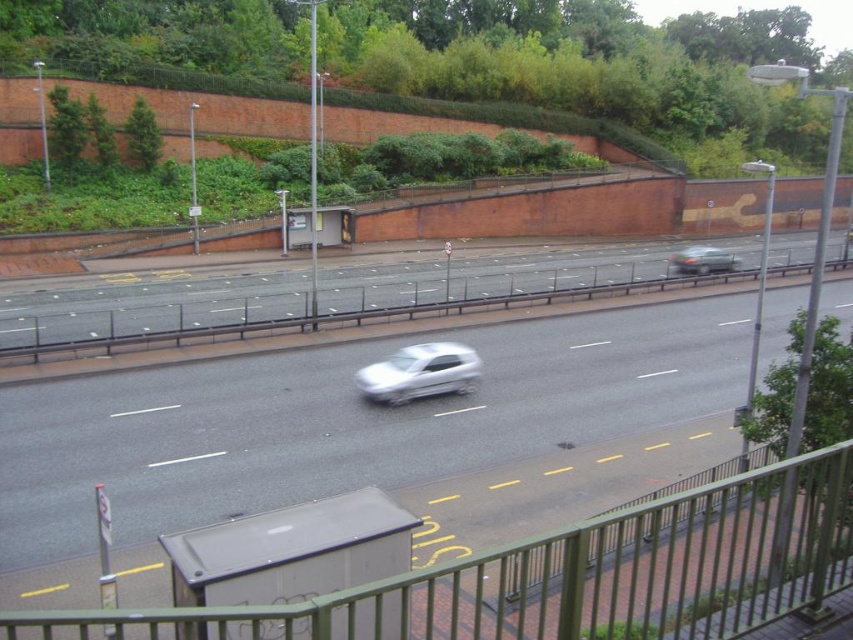
Is white glossy car at center behind green metallic car at right?

No, white glossy car at center is in front of green metallic car at right.

Between white glossy car at center and green metallic car at right, which one has more height?

Standing taller between the two is green metallic car at right.

Image resolution: width=853 pixels, height=640 pixels. Describe the element at coordinates (421, 372) in the screenshot. I see `white glossy car at center` at that location.

You are a GUI agent. You are given a task and a screenshot of the screen. Output one action in this format:
    pyautogui.click(x=<x>, y=<y>)
    Task: Click on the white glossy car at center
    Image resolution: width=853 pixels, height=640 pixels.
    Given the screenshot: What is the action you would take?
    pyautogui.click(x=421, y=372)

Which of these two, smooth gray road at center or green metallic car at right, stands taller?

smooth gray road at center is taller.

Between point (274, 321) and point (701, 246), which one is positioned behind?

Point (701, 246)

Image resolution: width=853 pixels, height=640 pixels. I want to click on smooth gray road at center, so click(x=339, y=305).

Can you confirm if smooth gray road at center is positioned below white glossy car at center?

No.

Is smooth gray road at center taller than white glossy car at center?

Yes, smooth gray road at center is taller than white glossy car at center.

Find the location of a particular element. This screenshot has width=853, height=640. smooth gray road at center is located at coordinates (339, 305).

What are the coordinates of `smooth gray road at center` in the screenshot? It's located at (339, 305).